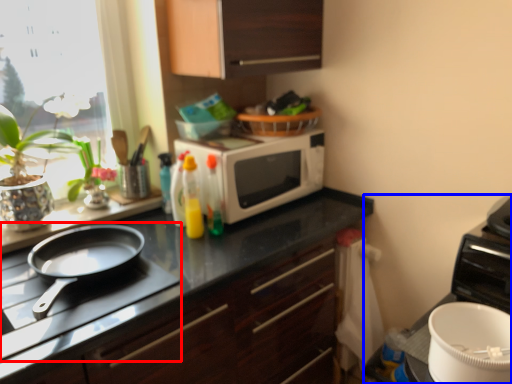
Question: Which object appears closest to the camera in this image, gas stove (highlighted by a red box) or appliance (highlighted by a blue box)?

Choices:
 (A) gas stove
 (B) appliance

Answer: (A)